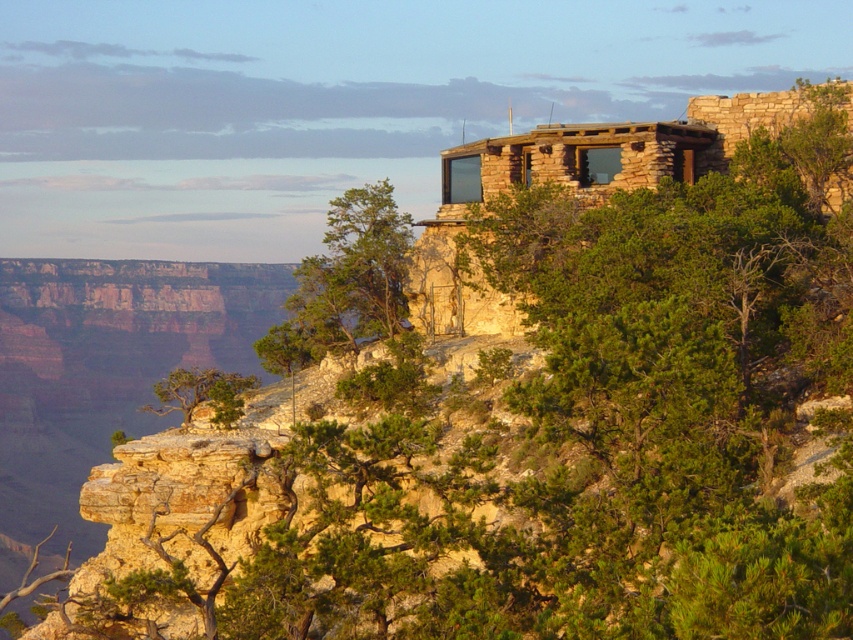
Which is behind, point (386, 182) or point (164, 396)?

The point (164, 396) is more distant.

Who is shorter, green leafy tree at upper right or green rough bark tree at center?

Standing shorter between the two is green leafy tree at upper right.

Where is `green leafy tree at upper right`? The width and height of the screenshot is (853, 640). green leafy tree at upper right is located at coordinates (345, 284).

What are the coordinates of `green leafy tree at upper right` in the screenshot? It's located at (345, 284).